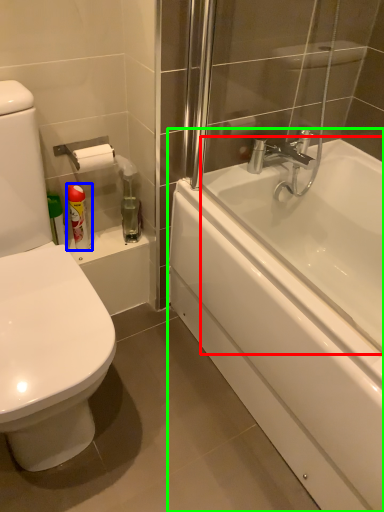
Question: Which is farther away from bath (highlighted by a red box)? toiletry (highlighted by a blue box) or bathtub (highlighted by a green box)?

Choices:
 (A) toiletry
 (B) bathtub

Answer: (A)